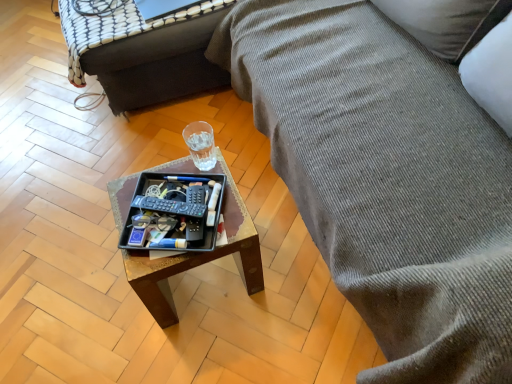
Locate an element on the screen. The height and width of the screenshot is (384, 512). free space above wooden tray at center (from a real-world perspective) is located at coordinates (x=180, y=220).